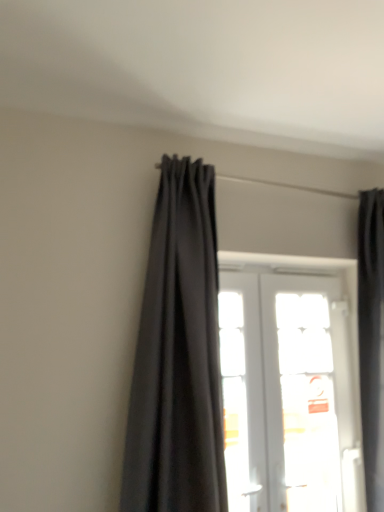
What do you see at coordinates (178, 356) in the screenshot? The image size is (384, 512). I see `dark gray fabric curtain at center` at bounding box center [178, 356].

You are a GUI agent. You are given a task and a screenshot of the screen. Output one action in this format:
    pyautogui.click(x=<x>, y=<y>)
    Task: Click on the dark gray fabric curtain at center
    Image resolution: width=384 pixels, height=512 pixels.
    Given the screenshot: What is the action you would take?
    pyautogui.click(x=178, y=356)

What is the approximate width of dark gray fabric curtain at center?

dark gray fabric curtain at center is 13.42 inches in width.

The height and width of the screenshot is (512, 384). Identify the location of white glossy door at center. (284, 390).

What do you see at coordinates (284, 390) in the screenshot? The width and height of the screenshot is (384, 512). I see `white glossy door at center` at bounding box center [284, 390].

Measure the distance between white glossy door at center and camera.

They are 1.67 meters apart.

Where is `dark gray fabric curtain at center`? dark gray fabric curtain at center is located at coordinates (178, 356).

Is white glossy door at center at the right side of dark gray fabric curtain at center?

Indeed, white glossy door at center is positioned on the right side of dark gray fabric curtain at center.

Is white glossy door at center further to the viewer compared to dark gray fabric curtain at center?

That is True.

Does point (295, 326) come farther from viewer compared to point (186, 231)?

Yes, it is behind point (186, 231).

From the image's perspective, does white glossy door at center appear higher than dark gray fabric curtain at center?

Incorrect, from the image's perspective, white glossy door at center is lower than dark gray fabric curtain at center.

From a real-world perspective, which object rests below the other?

white glossy door at center is physically lower.

Considering the sizes of objects white glossy door at center and dark gray fabric curtain at center in the image provided, who is wider, white glossy door at center or dark gray fabric curtain at center?

Wider between the two is dark gray fabric curtain at center.

Which of these two, white glossy door at center or dark gray fabric curtain at center, stands shorter?

With less height is white glossy door at center.

Considering the relative sizes of white glossy door at center and dark gray fabric curtain at center in the image provided, is white glossy door at center smaller than dark gray fabric curtain at center?

Indeed, white glossy door at center has a smaller size compared to dark gray fabric curtain at center.

Is white glossy door at center not inside dark gray fabric curtain at center?

white glossy door at center is positioned outside dark gray fabric curtain at center.

Are white glossy door at center and dark gray fabric curtain at center far apart?

They are positioned close to each other.

In the scene shown: Is dark gray fabric curtain at center at the back of white glossy door at center?

No, white glossy door at center is not facing away from dark gray fabric curtain at center.

Can you tell me how much white glossy door at center and dark gray fabric curtain at center differ in facing direction?

There is a 0.598-degree angle between the facing directions of white glossy door at center and dark gray fabric curtain at center.

How distant is white glossy door at center from dark gray fabric curtain at center?

white glossy door at center is 56.12 centimeters away from dark gray fabric curtain at center.

This screenshot has width=384, height=512. In order to click on curtain on the left of the white glossy door at center in this screenshot , I will do `click(178, 356)`.

Consider the image. Considering the positions of objects dark gray fabric curtain at center and white glossy door at center in the image provided, who is more to the left, dark gray fabric curtain at center or white glossy door at center?

dark gray fabric curtain at center is more to the left.

Is dark gray fabric curtain at center closer to the viewer compared to white glossy door at center?

Yes.

Is point (168, 189) positioned before point (317, 436)?

Yes, point (168, 189) is closer to viewer.

From the image's perspective, is dark gray fabric curtain at center on top of white glossy door at center?

Yes, from the image's perspective, dark gray fabric curtain at center is above white glossy door at center.

From a real-world perspective, is dark gray fabric curtain at center positioned above or below white glossy door at center?

dark gray fabric curtain at center is situated higher than white glossy door at center in the real world.

Looking at their sizes, would you say dark gray fabric curtain at center is wider or thinner than white glossy door at center?

Clearly, dark gray fabric curtain at center has more width compared to white glossy door at center.

Between dark gray fabric curtain at center and white glossy door at center, which one has less height?

Standing shorter between the two is white glossy door at center.

Is dark gray fabric curtain at center bigger or smaller than white glossy door at center?

dark gray fabric curtain at center is bigger than white glossy door at center.

Is white glossy door at center inside dark gray fabric curtain at center?

Definitely not — white glossy door at center is not inside dark gray fabric curtain at center.

Is dark gray fabric curtain at center not near white glossy door at center?

That's not correct — dark gray fabric curtain at center is a little close to white glossy door at center.

Is dark gray fabric curtain at center facing away from white glossy door at center?

dark gray fabric curtain at center does not have its back to white glossy door at center.

Can you tell me how much dark gray fabric curtain at center and white glossy door at center differ in facing direction?

dark gray fabric curtain at center and white glossy door at center are facing 0.598 degrees away from each other.

How distant is dark gray fabric curtain at center from white glossy door at center?

dark gray fabric curtain at center is 22.09 inches from white glossy door at center.

I want to click on door that is below the dark gray fabric curtain at center (from the image's perspective), so click(x=284, y=390).

The width and height of the screenshot is (384, 512). There is a white glossy door at center. What are the coordinates of `curtain above it (from a real-world perspective)` in the screenshot? It's located at (178, 356).

Identify the location of door located behind the dark gray fabric curtain at center. (284, 390).